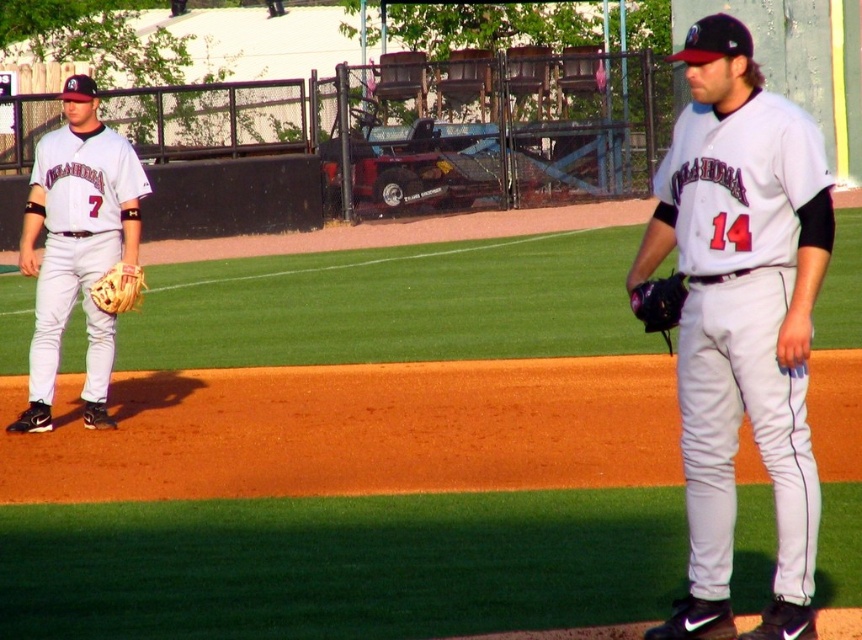
You are a photographer at the baseball game and want to capture both players in a single photo. Since the camera has a limited field of view, you need to position yourself so that the white matte baseball uniform at center and the matte white uniform at left are both visible. Based on their positions, which player should be placed closer to the left side of the photo?

The matte white uniform at left should be placed closer to the left side of the photo because the white matte baseball uniform at center is positioned on the right side of it.

You are a photographer taking a photo of the baseball game. You notice two points marked in the image. The first point is at coordinates point (804, 394) and the second point is at point (36, 401). Which point is closer to your camera lens?

Point (804, 394) is closer to the camera lens than point (36, 401).